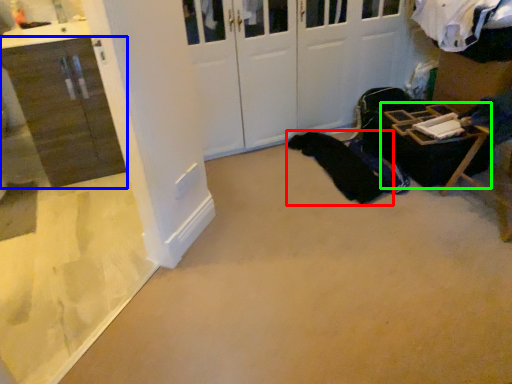
Question: Based on their relative distances, which object is nearer to clothing (highlighted by a red box)? Choose from cabinetry (highlighted by a blue box) and furniture (highlighted by a green box).

Choices:
 (A) cabinetry
 (B) furniture

Answer: (B)